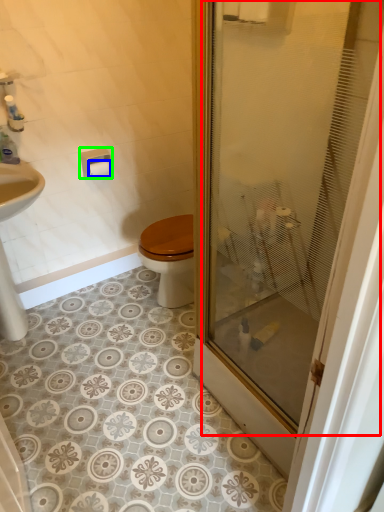
Question: Which is farther away from glass door (highlighted by a red box)? toilet paper (highlighted by a blue box) or towel bar (highlighted by a green box)?

Choices:
 (A) toilet paper
 (B) towel bar

Answer: (A)